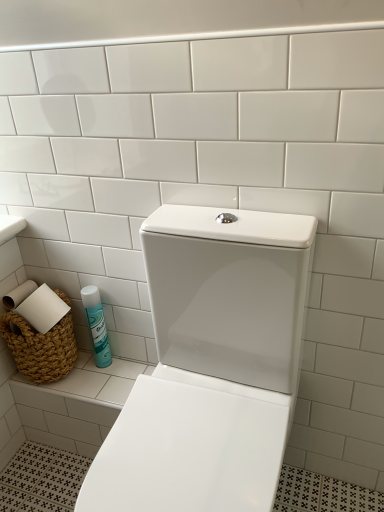
Question: From the image's perspective, relative to white glossy toilet at center, is blue glossy can at lower left above or below?

Choices:
 (A) below
 (B) above

Answer: (B)

Question: Is point (86, 302) positioned closer to the camera than point (243, 402)?

Choices:
 (A) farther
 (B) closer

Answer: (A)

Question: Considering the real-world distances, which object is closest to the white glossy toilet at center?

Choices:
 (A) blue glossy can at lower left
 (B) braided wicker basket at lower left

Answer: (A)

Question: Estimate the real-world distances between objects in this image. Which object is farther from the white glossy toilet at center?

Choices:
 (A) blue glossy can at lower left
 (B) braided wicker basket at lower left

Answer: (B)